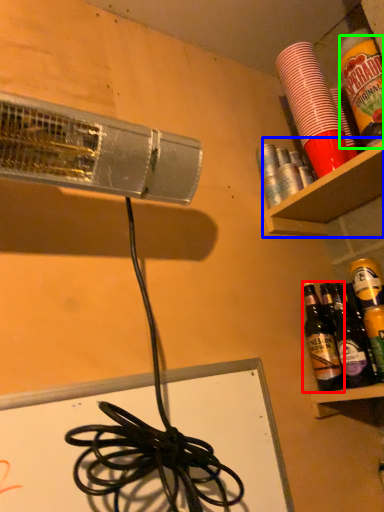
Question: Which object is positioned closest to bottle (highlighted by a red box)? Select from shelf (highlighted by a blue box) and beverage (highlighted by a green box).

Choices:
 (A) shelf
 (B) beverage

Answer: (A)